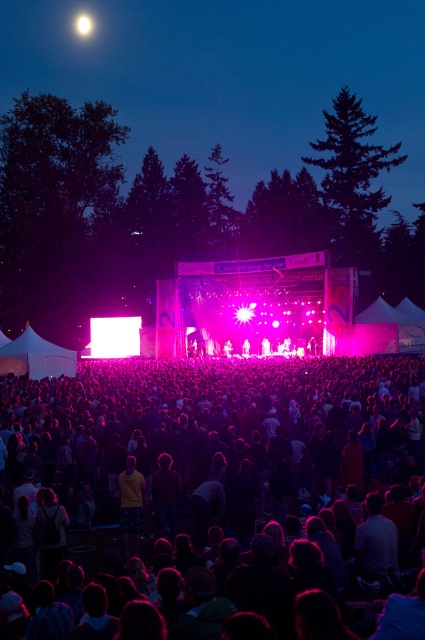
You are a photographer at the concert. You want to take a photo of the yellow cotton shirt at center without the black fabric crowd at center blocking it. Is this possible given their positions?

The black fabric crowd at center is in front of the yellow cotton shirt at center, so it would block the view. To capture the yellow cotton shirt at center without obstruction, you would need to move to a position where the crowd is not between you and the shirt.

You are a photographer at the concert trying to capture a photo of the yellow cotton shirt at center without the black fabric crowd at center blocking it. Can you adjust your angle to avoid the crowd?

The black fabric crowd at center is located above the yellow cotton shirt at center, so if you lower your camera angle slightly, you can capture the yellow cotton shirt at center without the crowd blocking it.

You are a photographer at the concert trying to capture a photo of the yellow cotton shirt at center without the black fabric crowd at center blocking it. Is it possible to do so given their heights?

The black fabric crowd at center has a greater height compared to yellow cotton shirt at center, so it might block the view. To avoid blocking, you could try crouching or moving to a higher position to frame the shot around the crowd.